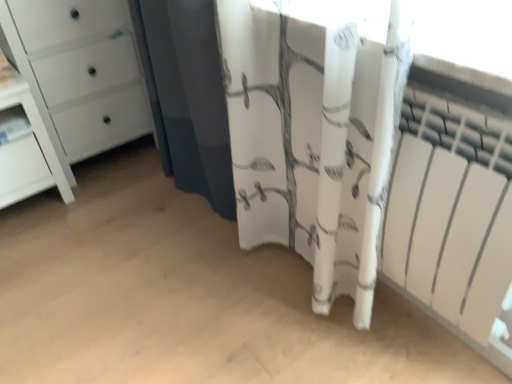
Image resolution: width=512 pixels, height=384 pixels. Identify the location of vacant region under white glossy bookshelf at left (from a real-world perspective). (26, 210).